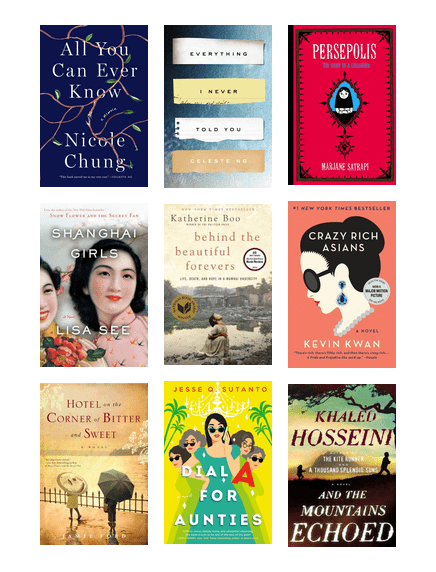
The width and height of the screenshot is (436, 572). I want to click on sticker, so click(x=378, y=288), click(x=255, y=257), click(x=183, y=305).